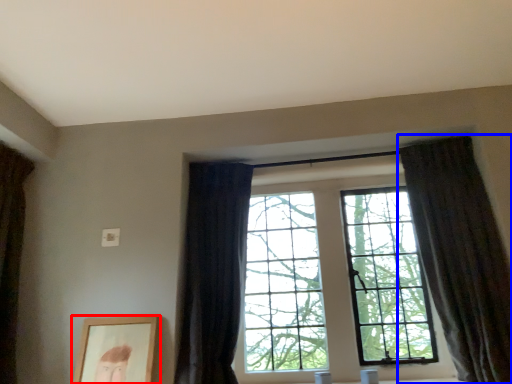
Question: Among these objects, which one is nearest to the camera, picture frame (highlighted by a red box) or curtain (highlighted by a blue box)?

Choices:
 (A) picture frame
 (B) curtain

Answer: (B)